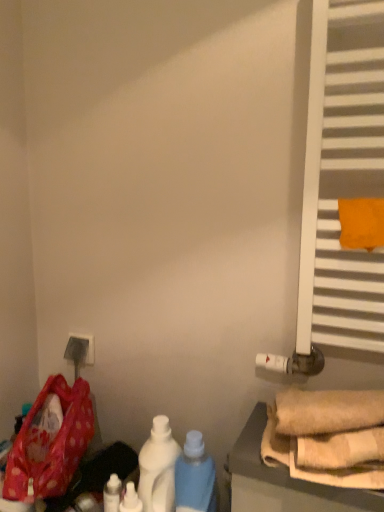
The height and width of the screenshot is (512, 384). What do you see at coordinates (80, 350) in the screenshot?
I see `matte plastic outlet at lower left` at bounding box center [80, 350].

In order to face white matte radiator at right, should I rotate leftwards or rightwards?

A 17.694 degree turn to the right will do.

What do you see at coordinates (195, 477) in the screenshot?
I see `white glossy bottle at lower center, placed as the 4th bottle when sorted from left to right` at bounding box center [195, 477].

In order to face white glossy bottle at lower center, which ranks as the third bottle in right-to-left order, should I rotate leftwards or rightwards?

Rotate your view left by about 8.439°.

What do you see at coordinates (361, 223) in the screenshot? The width and height of the screenshot is (384, 512). I see `orange fabric towel at right` at bounding box center [361, 223].

What do you see at coordinates (50, 442) in the screenshot? This screenshot has width=384, height=512. I see `polka dot fabric bag at lower left` at bounding box center [50, 442].

What are the coordinates of `matte plastic outlet at lower left` in the screenshot? It's located at (80, 350).

Starting from the matte plastic outlet at lower left, which bottle is the 4th one in front? Please provide its 2D coordinates.

[(195, 477)]

Is white glossy bottle at lower center, placed as the 4th bottle when sorted from left to right, positioned behind matte plastic outlet at lower left?

No, it is not.

From the image's perspective, which one is positioned lower, white glossy bottle at lower center, which is the first bottle from right to left, or matte plastic outlet at lower left?

white glossy bottle at lower center, which is the first bottle from right to left, from the image's perspective.

Consider the image. Can you see white matte radiator at right touching orange fabric towel at right?

No.

The width and height of the screenshot is (384, 512). Find the location of `window behind the orange fabric towel at right`. window behind the orange fabric towel at right is located at coordinates (343, 178).

Between white matte radiator at right and orange fabric towel at right, which one appears on the left side from the viewer's perspective?

white matte radiator at right.

Which point is more distant from viewer, (179, 465) or (44, 413)?

Answer: The point (44, 413) is more distant.

Is white glossy bottle at lower center, which is the first bottle from right to left, closer to the viewer compared to polka dot fabric bag at lower left?

Yes, the depth of white glossy bottle at lower center, which is the first bottle from right to left, is less than that of polka dot fabric bag at lower left.

Could you tell me if white glossy bottle at lower center, which is the first bottle from right to left, is turned towards polka dot fabric bag at lower left?

No, white glossy bottle at lower center, which is the first bottle from right to left, is not facing towards polka dot fabric bag at lower left.

Is the position of matte plastic outlet at lower left more distant than that of orange fabric towel at right?

Yes, it is behind orange fabric towel at right.

At what (x,y) coordinates should I click in order to perform the action: click on beach towel above the matte plastic outlet at lower left (from a real-world perspective). Please return your answer as a coordinate pair (x, y). This screenshot has width=384, height=512. Looking at the image, I should click on (361, 223).

Is matte plastic outlet at lower left not within orange fabric towel at right?

That's correct, matte plastic outlet at lower left is outside of orange fabric towel at right.

Could you measure the distance between polka dot fabric bag at lower left and white glossy bottle at lower center, positioned as the 2th bottle in left-to-right order?

They are 23.56 centimeters apart.

Is polka dot fabric bag at lower left at the right side of white glossy bottle at lower center, positioned as the 2th bottle in left-to-right order?

In fact, polka dot fabric bag at lower left is to the left of white glossy bottle at lower center, positioned as the 2th bottle in left-to-right order.

From a real-world perspective, which object stands above the other?

polka dot fabric bag at lower left.

Based on the photo, is polka dot fabric bag at lower left surrounding white glossy bottle at lower center, positioned as the 2th bottle in left-to-right order?

That's incorrect, white glossy bottle at lower center, positioned as the 2th bottle in left-to-right order, is not inside polka dot fabric bag at lower left.

Consider the image. Is white glossy bottle at lower left, positioned as the 4th bottle in right-to-left order, shorter than white glossy bottle at lower center, positioned as the 2th bottle in left-to-right order?

In fact, white glossy bottle at lower left, positioned as the 4th bottle in right-to-left order, may be taller than white glossy bottle at lower center, positioned as the 2th bottle in left-to-right order.

Consider the image. Which object is wider, white glossy bottle at lower left, positioned as the 4th bottle in right-to-left order, or white glossy bottle at lower center, positioned as the 2th bottle in left-to-right order?

white glossy bottle at lower center, positioned as the 2th bottle in left-to-right order, is wider.

Between white glossy bottle at lower left, marked as the 1th bottle in a left-to-right arrangement, and white glossy bottle at lower center, which ranks as the third bottle in right-to-left order, which one is positioned in front?

white glossy bottle at lower center, which ranks as the third bottle in right-to-left order, is in front.

Which is closer, (x=106, y=501) or (x=129, y=496)?

Point (x=106, y=501) is positioned farther from the camera compared to point (x=129, y=496).

Is white matte bottle at center, placed as the second bottle when sorted from right to left, at the back of matte plastic outlet at lower left?

No, white matte bottle at center, placed as the second bottle when sorted from right to left, is not at the back of matte plastic outlet at lower left.

Is matte plastic outlet at lower left bigger or smaller than white matte bottle at center, placed as the third bottle when sorted from left to right?

In the image, matte plastic outlet at lower left appears to be smaller than white matte bottle at center, placed as the third bottle when sorted from left to right.

Is matte plastic outlet at lower left at the left side of white matte bottle at center, placed as the third bottle when sorted from left to right?

Indeed, matte plastic outlet at lower left is positioned on the left side of white matte bottle at center, placed as the third bottle when sorted from left to right.

Does point (81, 351) come closer to viewer compared to point (171, 462)?

No, it is not.

From the image's perspective, starting from the matte plastic outlet at lower left, which bottle is the 2nd one below? Please provide its 2D coordinates.

[(195, 477)]

Identify the location of beach towel in front of the white matte radiator at right. This screenshot has height=512, width=384. (361, 223).

Looking at the image, which one is located further to beige fabric towels at lower right, white glossy bottle at lower center, which ranks as the third bottle in right-to-left order, or white glossy bottle at lower center, placed as the 4th bottle when sorted from left to right?

Based on the image, white glossy bottle at lower center, which ranks as the third bottle in right-to-left order, appears to be further to beige fabric towels at lower right.

From the image, which object appears to be farther from matte plastic outlet at lower left, white matte radiator at right or orange fabric towel at right?

orange fabric towel at right is positioned further to the anchor matte plastic outlet at lower left.

Based on their spatial positions, is orange fabric towel at right or white glossy bottle at lower center, which is the first bottle from right to left, closer to white glossy bottle at lower left, marked as the 1th bottle in a left-to-right arrangement?

white glossy bottle at lower center, which is the first bottle from right to left.

Consider the image. Looking at the image, which one is located closer to white matte radiator at right, white glossy bottle at lower left, positioned as the 4th bottle in right-to-left order, or white matte bottle at center, placed as the third bottle when sorted from left to right?

Based on the image, white matte bottle at center, placed as the third bottle when sorted from left to right, appears to be nearer to white matte radiator at right.

Based on their spatial positions, is matte plastic outlet at lower left or white glossy bottle at lower left, positioned as the 4th bottle in right-to-left order, further from white glossy bottle at lower center, positioned as the 2th bottle in left-to-right order?

matte plastic outlet at lower left lies further to white glossy bottle at lower center, positioned as the 2th bottle in left-to-right order, than the other object.

Which object lies nearer to the anchor point matte plastic outlet at lower left, white glossy bottle at lower center, which ranks as the third bottle in right-to-left order, or white glossy bottle at lower center, which is the first bottle from right to left?

white glossy bottle at lower center, which ranks as the third bottle in right-to-left order.

From the image, which object appears to be farther from white glossy bottle at lower center, which ranks as the third bottle in right-to-left order, white glossy bottle at lower left, marked as the 1th bottle in a left-to-right arrangement, or orange fabric towel at right?

Among the two, orange fabric towel at right is located further to white glossy bottle at lower center, which ranks as the third bottle in right-to-left order.

Estimate the real-world distances between objects in this image. Which object is closer to white glossy bottle at lower center, placed as the 4th bottle when sorted from left to right, white glossy bottle at lower left, positioned as the 4th bottle in right-to-left order, or white glossy bottle at lower center, which ranks as the third bottle in right-to-left order?

white glossy bottle at lower center, which ranks as the third bottle in right-to-left order, is positioned closer to the anchor white glossy bottle at lower center, placed as the 4th bottle when sorted from left to right.

I want to click on wide between white matte radiator at right and white matte bottle at center, placed as the second bottle when sorted from right to left, vertically, so click(x=50, y=442).

Where is `furniture between white matte radiator at right and white glossy bottle at lower center, which is the first bottle from right to left, in the up-down direction`? Image resolution: width=384 pixels, height=512 pixels. furniture between white matte radiator at right and white glossy bottle at lower center, which is the first bottle from right to left, in the up-down direction is located at coordinates (283, 480).

Find the location of `electric outlet between white matte radiator at right and white glossy bottle at lower left, marked as the 1th bottle in a left-to-right arrangement, from top to bottom`. electric outlet between white matte radiator at right and white glossy bottle at lower left, marked as the 1th bottle in a left-to-right arrangement, from top to bottom is located at coordinates (80, 350).

The image size is (384, 512). What are the coordinates of `electric outlet between polka dot fabric bag at lower left and orange fabric towel at right` in the screenshot? It's located at click(x=80, y=350).